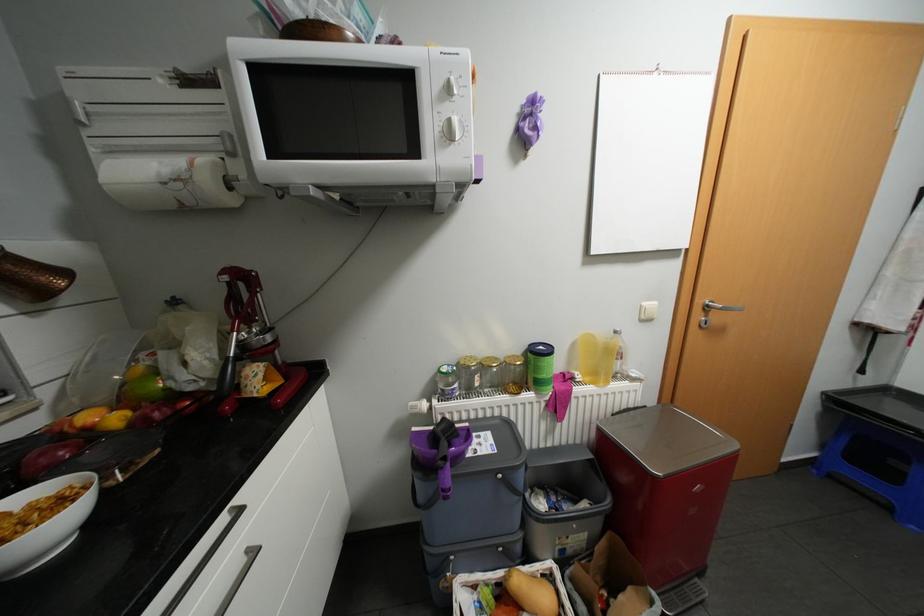
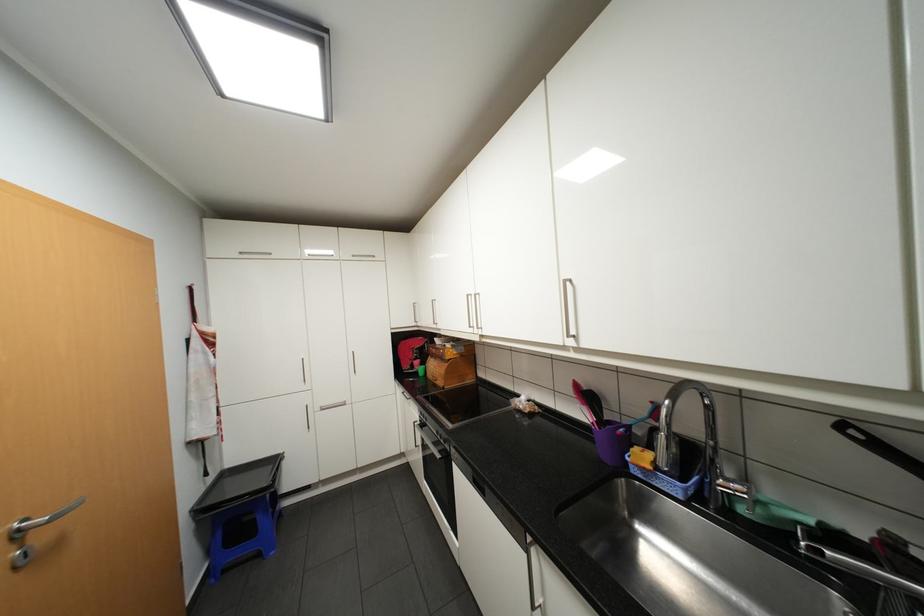
Locate, in the second image, the point that corresponds to point (715, 305) in the first image.

(27, 530)